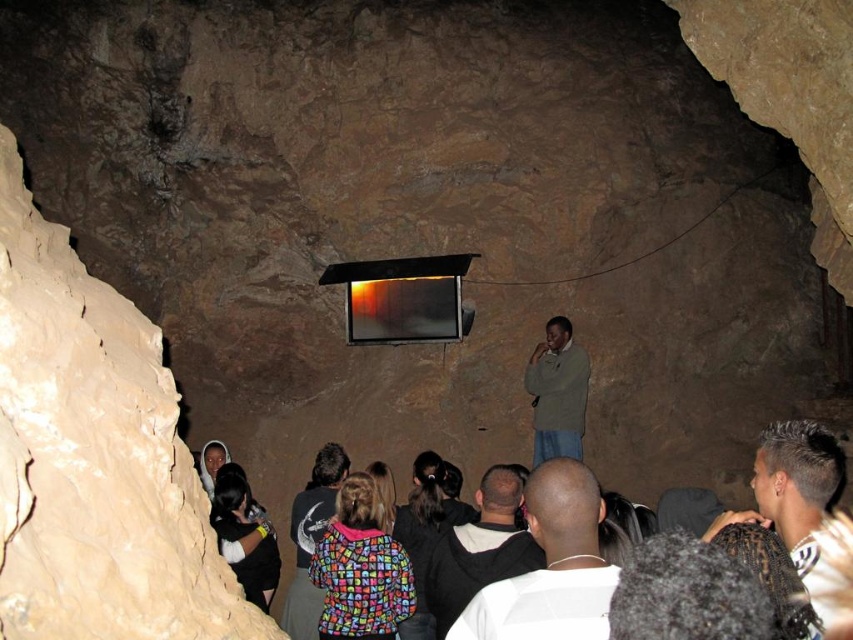
You are standing at the entrance of the cave and want to take a photo of the white shirt at center. Which direction should you face to capture it in your camera view?

The white shirt at center is located at point 0.886 on the x axis and 0.646 on the y axis, so you should face towards the center area of the cave to capture it in your camera view.

You are part of the group watching the screen in the cave. You notice two people in the center wearing white shirt at center and dark gray shirt at center. Which one is standing to the right of the other?

The white shirt at center is positioned on the right side of dark gray shirt at center.